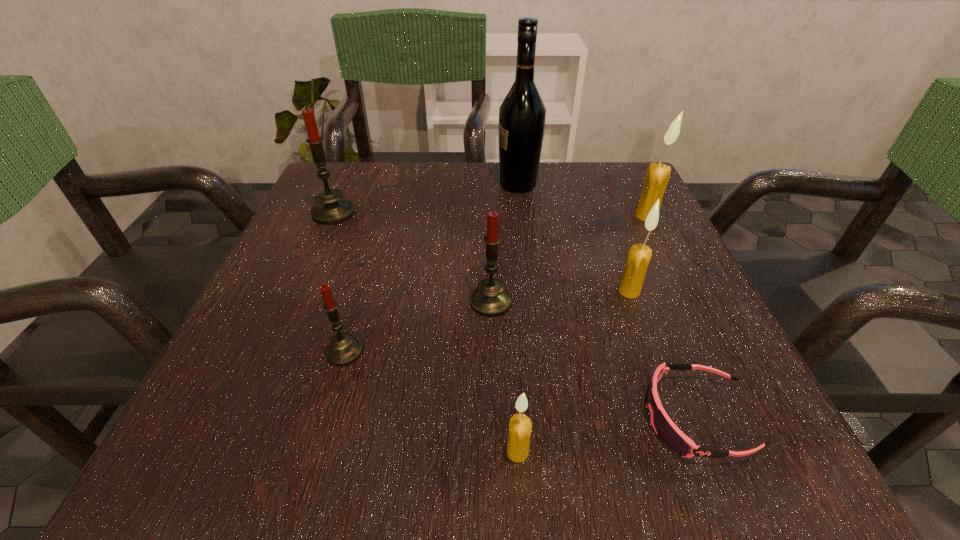
Where is `blank space at the far right corner of the desktop`? This screenshot has height=540, width=960. blank space at the far right corner of the desktop is located at coordinates (x=619, y=217).

In the image, there is a desktop. Where is `vacant area at the near right corner`? vacant area at the near right corner is located at coordinates (690, 435).

Where is `free space between the leftmost object and the second farthest red candle`? free space between the leftmost object and the second farthest red candle is located at coordinates (412, 258).

The image size is (960, 540). I want to click on empty location between the second cream candle from left to right and the sixth farthest object, so click(487, 322).

You are a GUI agent. You are given a task and a screenshot of the screen. Output one action in this format:
    pyautogui.click(x=<x>, y=<y>)
    Task: Click on the free space that is in between the leftmost red candle and the rightmost red candle
    The image size is (960, 540).
    Given the screenshot: What is the action you would take?
    click(x=412, y=258)

Where is `vacant point located between the biggest red candle and the sixth farthest object`? vacant point located between the biggest red candle and the sixth farthest object is located at coordinates (339, 282).

I want to click on free space between the second smallest red candle and the farthest red candle, so click(412, 258).

Image resolution: width=960 pixels, height=540 pixels. Identify the location of empty space between the pink goggles and the second nearest red candle. (594, 360).

At what (x,y) coordinates should I click in order to perform the action: click on free space between the second red candle from right to left and the second nearest cream candle. Please return your answer as a coordinate pair (x, y). Looking at the image, I should click on (487, 322).

This screenshot has height=540, width=960. I want to click on free space between the shortest object and the rightmost red candle, so click(594, 360).